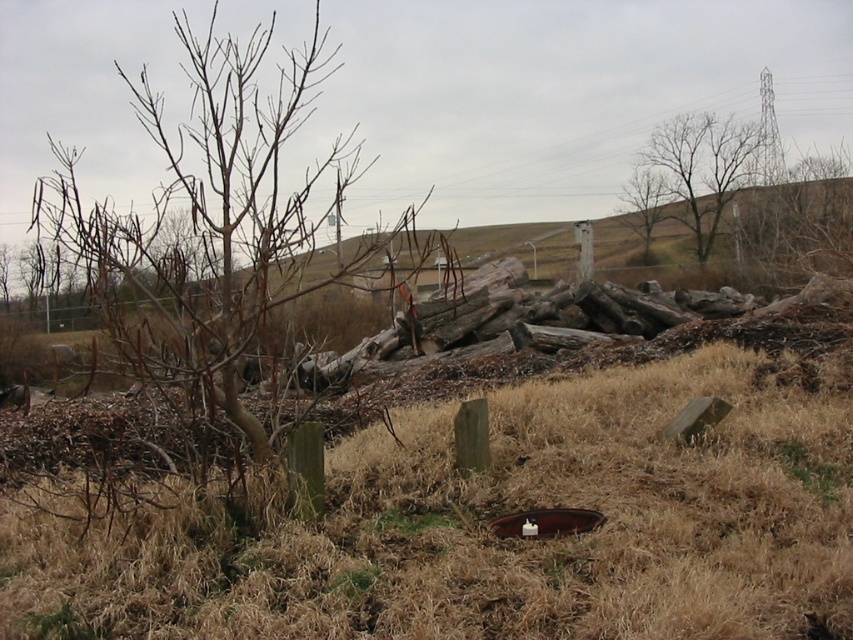
Question: Can you confirm if brown dry grass at center is positioned below bare wood tree at upper right?

Choices:
 (A) no
 (B) yes

Answer: (B)

Question: Which object is farther from the camera taking this photo?

Choices:
 (A) bare wood tree at upper right
 (B) brown wood tree at upper center
 (C) brown dry grass at center

Answer: (A)

Question: Which object appears closest to the camera in this image?

Choices:
 (A) bare wood tree at upper right
 (B) brown dry grass at center
 (C) brown wood tree at upper center

Answer: (B)

Question: Which of the following is the closest to the observer?

Choices:
 (A) (55, 561)
 (B) (659, 221)
 (C) (714, 208)

Answer: (A)

Question: Where is bare wood tree at upper right located in relation to brown wood tree at upper center in the image?

Choices:
 (A) right
 (B) left

Answer: (A)

Question: Is bare wood tree at upper right positioned before brown wood tree at upper center?

Choices:
 (A) no
 (B) yes

Answer: (A)